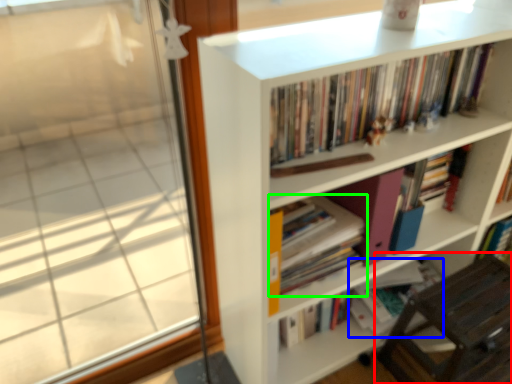
Question: Based on their relative distances, which object is farther from chair (highlighted by a red box)? Choose from book (highlighted by a blue box) and book (highlighted by a green box).

Choices:
 (A) book
 (B) book

Answer: (B)